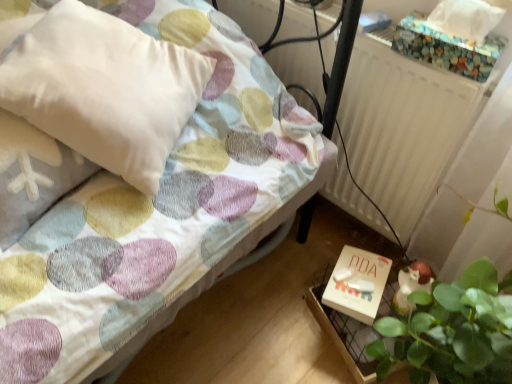
I want to click on pastel polka dot fabric bed at center, so click(x=156, y=211).

Find the location of a particular element. The height and width of the screenshot is (384, 512). white soft pillow at upper left is located at coordinates (102, 87).

Find the location of a particular element. white matte radiator at upper right is located at coordinates (402, 127).

Is point (359, 82) closer to viewer compared to point (192, 75)?

No, (359, 82) is behind (192, 75).

Identify the location of radiator below the white soft pillow at upper left (from a real-world perspective). This screenshot has height=384, width=512. (402, 127).

Can you confirm if white matte radiator at upper right is shorter than white soft pillow at upper left?

No.

Does white matte radiator at upper right have a larger size compared to white soft pillow at upper left?

Incorrect, white matte radiator at upper right is not larger than white soft pillow at upper left.

Is white soft pillow at upper left positioned before white matte box at lower right?

That is True.

Considering the sizes of white soft pillow at upper left and white matte box at lower right in the image, is white soft pillow at upper left wider or thinner than white matte box at lower right?

white soft pillow at upper left is wider than white matte box at lower right.

Considering the relative positions of white soft pillow at upper left and white matte box at lower right in the image provided, is white soft pillow at upper left to the left or to the right of white matte box at lower right?

Based on their positions, white soft pillow at upper left is located to the left of white matte box at lower right.

Identify the location of box behind the white soft pillow at upper left. This screenshot has height=384, width=512. (357, 284).

Is white soft pillow at upper left positioned before white matte radiator at upper right?

Yes, white soft pillow at upper left is in front of white matte radiator at upper right.

From a real-world perspective, is white soft pillow at upper left physically above white matte radiator at upper right?

Yes, from a real-world perspective, white soft pillow at upper left is above white matte radiator at upper right.

Which of these two, white soft pillow at upper left or white matte radiator at upper right, is thinner?

white matte radiator at upper right is thinner.

Is white soft pillow at upper left aimed at white matte radiator at upper right?

No, white soft pillow at upper left does not turn towards white matte radiator at upper right.

Does pastel polka dot fabric bed at center have a greater height compared to white soft pillow at upper left?

Indeed, pastel polka dot fabric bed at center has a greater height compared to white soft pillow at upper left.

Which object is positioned more to the right, pastel polka dot fabric bed at center or white soft pillow at upper left?

Positioned to the right is pastel polka dot fabric bed at center.

Does pastel polka dot fabric bed at center have a lesser width compared to white soft pillow at upper left?

Incorrect, the width of pastel polka dot fabric bed at center is not less than that of white soft pillow at upper left.

Based on the photo, considering the sizes of objects white matte box at lower right and white matte radiator at upper right in the image provided, who is bigger, white matte box at lower right or white matte radiator at upper right?

white matte radiator at upper right is bigger.

Are white matte box at lower right and white matte radiator at upper right making contact?

No, white matte box at lower right is not touching white matte radiator at upper right.

Does point (353, 279) come closer to viewer compared to point (234, 16)?

Yes, point (353, 279) is closer to viewer.

From a real-world perspective, is white matte box at lower right positioned over white matte radiator at upper right based on gravity?

Actually, white matte box at lower right is physically below white matte radiator at upper right in the real world.

Who is taller, white matte box at lower right or white soft pillow at upper left?

With more height is white soft pillow at upper left.

Are white matte box at lower right and white soft pillow at upper left far apart?

No, white matte box at lower right is not far from white soft pillow at upper left.

Considering the positions of point (362, 280) and point (63, 5), is point (362, 280) closer or farther from the camera than point (63, 5)?

Point (362, 280) appears to be farther away from the viewer than point (63, 5).

From the picture: Is white matte box at lower right oriented towards white soft pillow at upper left?

No, white matte box at lower right is not oriented towards white soft pillow at upper left.

From a real-world perspective, which object rests below the other?

white matte radiator at upper right is physically lower.

Between point (242, 122) and point (387, 209), which one is positioned behind?

The point (387, 209) is behind.

Are pastel polka dot fabric bed at center and white matte radiator at upper right beside each other?

No, pastel polka dot fabric bed at center is not in contact with white matte radiator at upper right.

Would you say white matte radiator at upper right is part of pastel polka dot fabric bed at center's contents?

No, white matte radiator at upper right is not surrounded by pastel polka dot fabric bed at center.

Identify the location of radiator behind the white soft pillow at upper left. (402, 127).

The image size is (512, 384). What are the coordinates of `pillow lying above the white matte box at lower right (from the image's perspective)` in the screenshot? It's located at (102, 87).

Estimate the real-world distances between objects in this image. Which object is further from pastel polka dot fabric bed at center, white matte radiator at upper right or white soft pillow at upper left?

white matte radiator at upper right is further to pastel polka dot fabric bed at center.

From the image, which object appears to be farther from white matte box at lower right, white matte radiator at upper right or pastel polka dot fabric bed at center?

Based on the image, pastel polka dot fabric bed at center appears to be further to white matte box at lower right.

Considering their positions, is pastel polka dot fabric bed at center positioned further to white matte radiator at upper right than white soft pillow at upper left?

Based on the image, white soft pillow at upper left appears to be further to white matte radiator at upper right.

Considering their positions, is white matte box at lower right positioned closer to white matte radiator at upper right than white soft pillow at upper left?

white matte box at lower right lies closer to white matte radiator at upper right than the other object.

Consider the image. Estimate the real-world distances between objects in this image. Which object is further from white soft pillow at upper left, white matte radiator at upper right or pastel polka dot fabric bed at center?

white matte radiator at upper right.

In the scene shown: Estimate the real-world distances between objects in this image. Which object is further from white matte box at lower right, pastel polka dot fabric bed at center or white matte radiator at upper right?

pastel polka dot fabric bed at center is further to white matte box at lower right.

Looking at the image, which one is located closer to white matte box at lower right, white soft pillow at upper left or pastel polka dot fabric bed at center?

Based on the image, pastel polka dot fabric bed at center appears to be nearer to white matte box at lower right.

When comparing their distances from pastel polka dot fabric bed at center, does white soft pillow at upper left or white matte radiator at upper right seem closer?

Among the two, white soft pillow at upper left is located nearer to pastel polka dot fabric bed at center.

This screenshot has width=512, height=384. Identify the location of pillow between pastel polka dot fabric bed at center and white matte radiator at upper right along the z-axis. (102, 87).

Identify the location of pillow positioned between pastel polka dot fabric bed at center and white matte box at lower right from near to far. (102, 87).

Locate an element on the screen. radiator positioned between pastel polka dot fabric bed at center and white matte box at lower right from near to far is located at coordinates (402, 127).

Find the location of `radiator situated between white soft pillow at upper left and white matte box at lower right from left to right`. radiator situated between white soft pillow at upper left and white matte box at lower right from left to right is located at coordinates (402, 127).